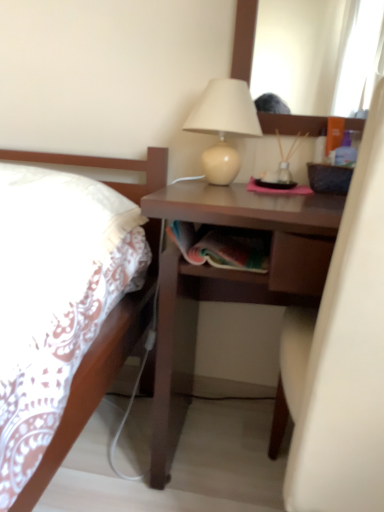
Question: Do you think brown matte desk at center is within matte beige lamp at upper center, or outside of it?

Choices:
 (A) outside
 (B) inside

Answer: (A)

Question: From a real-world perspective, is brown matte desk at center above or below matte beige lamp at upper center?

Choices:
 (A) below
 (B) above

Answer: (A)

Question: Is brown matte desk at center taller or shorter than matte beige lamp at upper center?

Choices:
 (A) tall
 (B) short

Answer: (A)

Question: Looking at their shapes, would you say matte beige lamp at upper center is wider or thinner than brown matte desk at center?

Choices:
 (A) wide
 (B) thin

Answer: (B)

Question: From the image's perspective, relative to brown matte desk at center, is matte beige lamp at upper center above or below?

Choices:
 (A) below
 (B) above

Answer: (B)

Question: Considering their positions, is matte beige lamp at upper center located in front of or behind brown matte desk at center?

Choices:
 (A) front
 (B) behind

Answer: (B)

Question: In terms of height, does matte beige lamp at upper center look taller or shorter compared to brown matte desk at center?

Choices:
 (A) tall
 (B) short

Answer: (B)